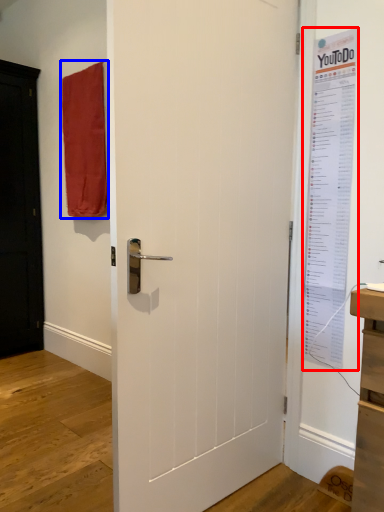
Question: Which point is further to the camera, poster page (highlighted by a red box) or curtain (highlighted by a blue box)?

Choices:
 (A) poster page
 (B) curtain

Answer: (B)